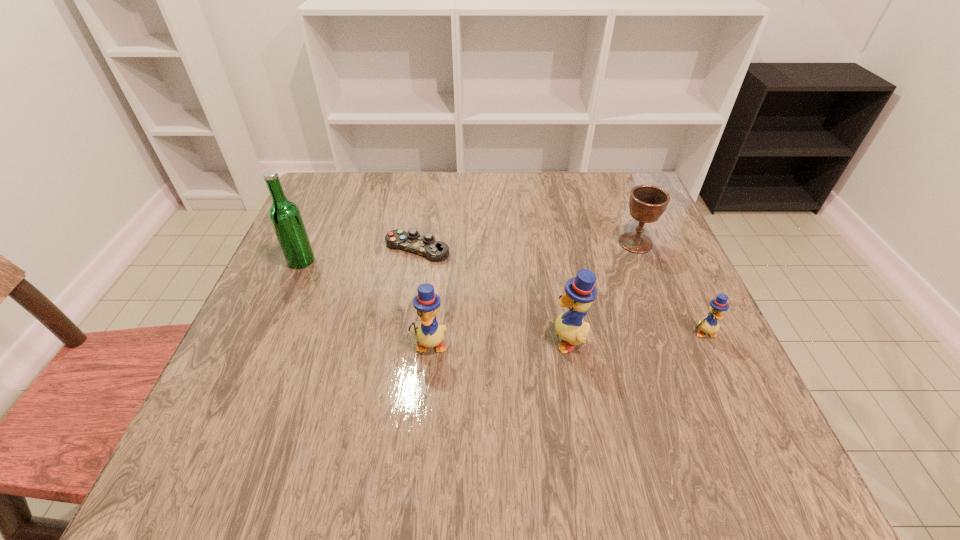
Where is `the second shortest duckling`? The height and width of the screenshot is (540, 960). the second shortest duckling is located at coordinates (429, 334).

At what (x,y) coordinates should I click in order to perform the action: click on the fourth object from left to right. Please return your answer as a coordinate pair (x, y). Looking at the image, I should click on (580, 292).

Identify the location of the rightmost object. The height and width of the screenshot is (540, 960). (709, 324).

Where is `the rightmost duckling`? This screenshot has width=960, height=540. the rightmost duckling is located at coordinates (709, 324).

Where is `the shortest object`? the shortest object is located at coordinates (426, 245).

Find the location of a particular element. This screenshot has width=960, height=540. the fifth object from left to right is located at coordinates (647, 203).

Find the location of a particular element. This screenshot has height=540, width=960. the leftmost object is located at coordinates [285, 217].

What are the coordinates of `beer bottle` in the screenshot? It's located at (285, 217).

This screenshot has width=960, height=540. I want to click on vacant region located on the face of the leftmost duckling, where the monocle is placed, so click(424, 400).

The image size is (960, 540). In order to click on free space located on the face of the second duckling from left to right, where the monocle is placed in this screenshot , I will do `click(365, 339)`.